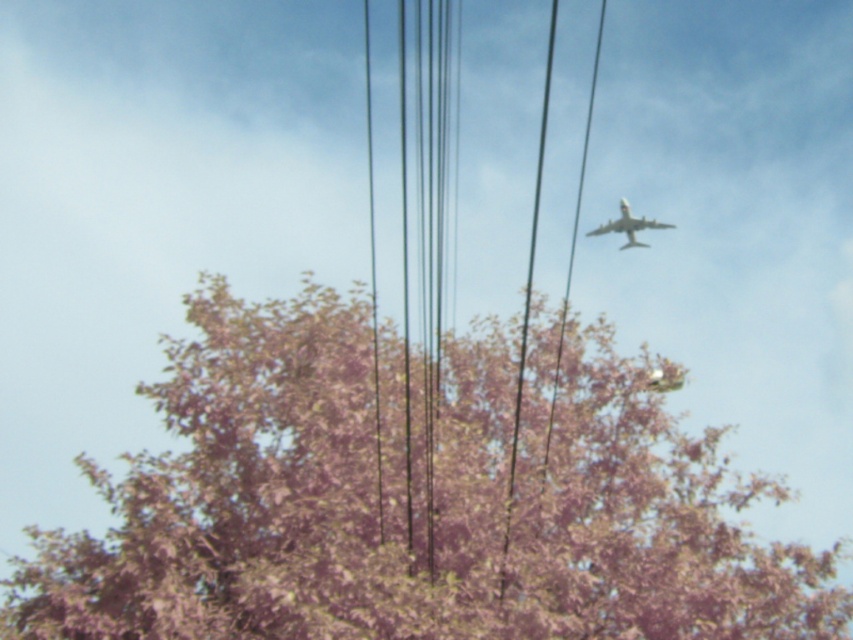
What are the coordinates of the pink leafy tree at upper center in the image?

The pink leafy tree at upper center is located at coordinates point (x=401, y=502).

You are a pilot flying the white matte airplane at upper right and want to avoid the pink leafy tree at upper center. Which direction should you steer the plane to move away from the tree?

The pink leafy tree at upper center is positioned under the white matte airplane at upper right, so steering the plane to the left or downward would move it away from the tree.